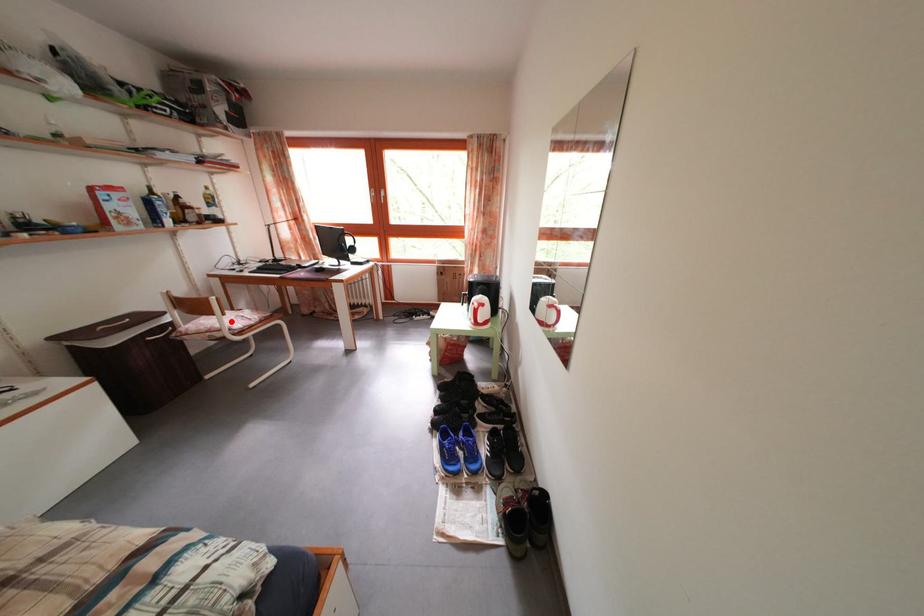
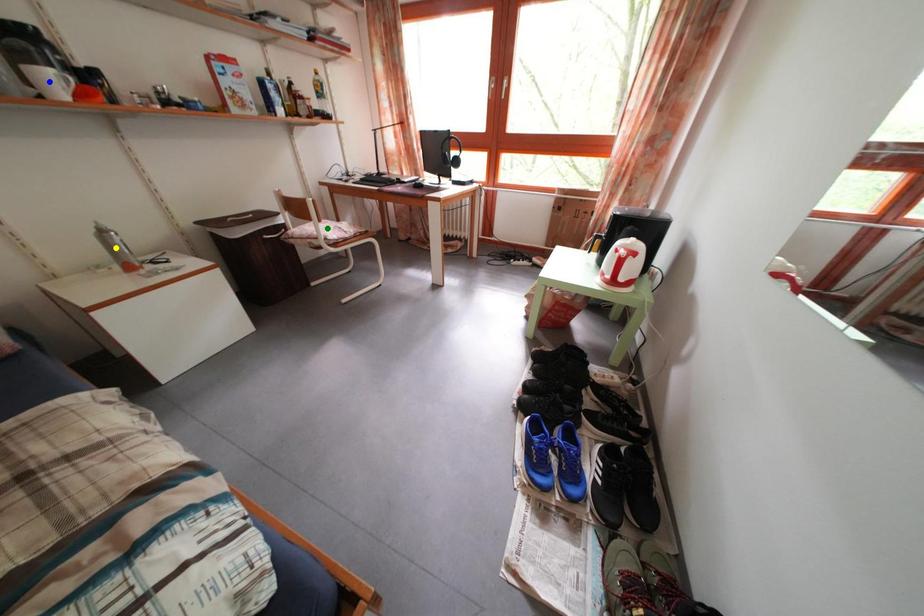
Question: I am providing you with two images of the same scene from different viewpoints. A red point is marked on the first image. You are given multiple points on the second image. Can you choose the point in image 2 that corresponds to the point in image 1?

Choices:
 (A) blue point
 (B) green point
 (C) yellow point

Answer: (B)